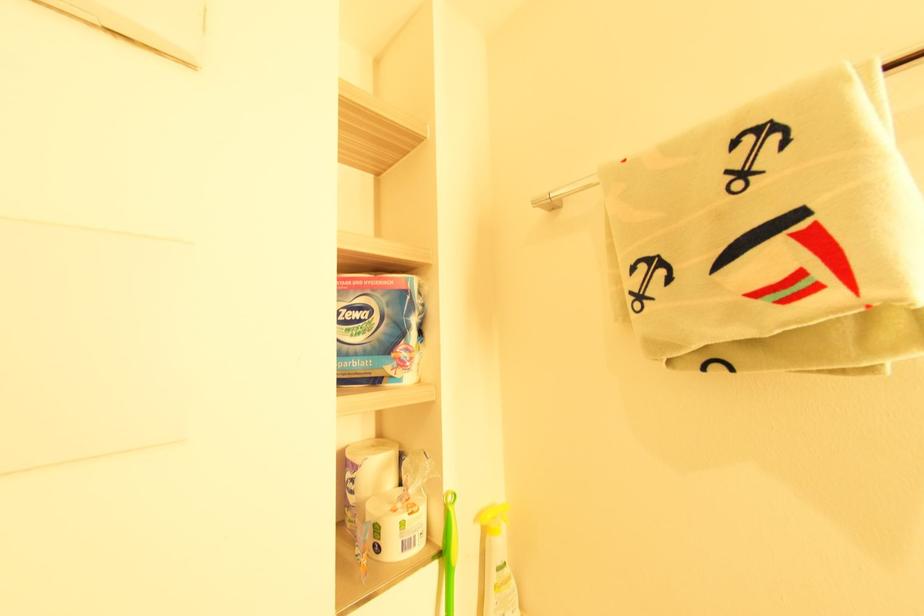
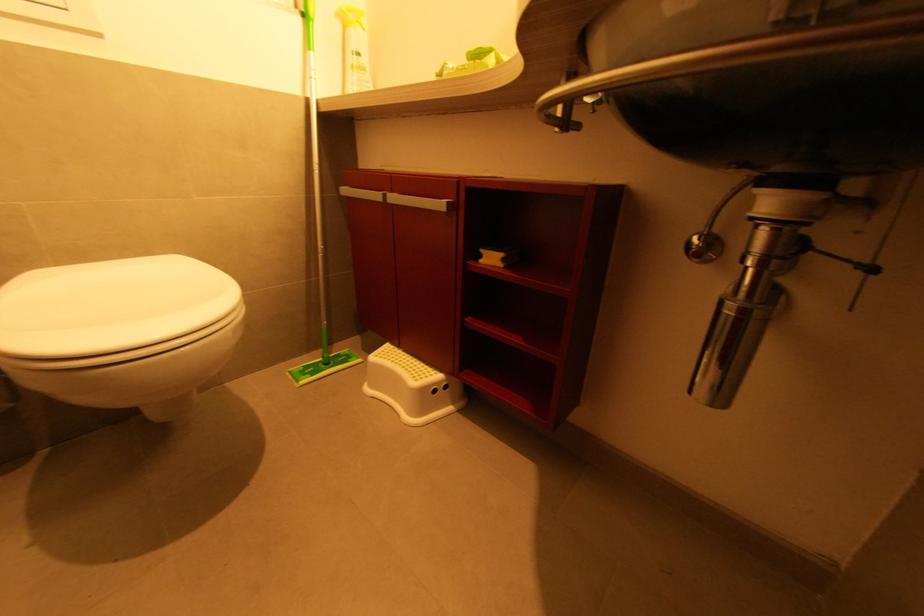
In a continuous first-person perspective shot, in which direction is the camera moving?

The cameraman moved toward right, backward.